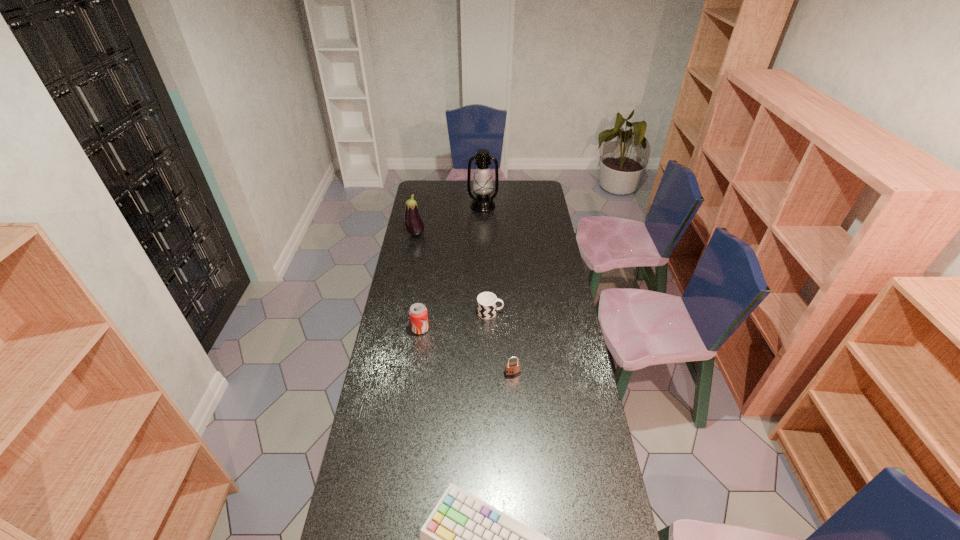
Locate an element on the screen. The height and width of the screenshot is (540, 960). the farthest object is located at coordinates (482, 186).

Where is `the tallest object`? The width and height of the screenshot is (960, 540). the tallest object is located at coordinates (482, 186).

Find the location of a particular element. The image size is (960, 540). the second tallest object is located at coordinates (414, 225).

Locate an element on the screen. the fifth nearest object is located at coordinates (414, 225).

Locate an element on the screen. This screenshot has height=540, width=960. soda can is located at coordinates (418, 314).

What are the coordinates of `the third nearest object` in the screenshot? It's located at (418, 314).

This screenshot has height=540, width=960. Find the location of `padlock`. padlock is located at coordinates (512, 369).

Find the location of a particular element. the third shortest object is located at coordinates (512, 369).

Find the location of `cup`. cup is located at coordinates (487, 308).

The image size is (960, 540). Identify the location of the third farthest object. (487, 308).